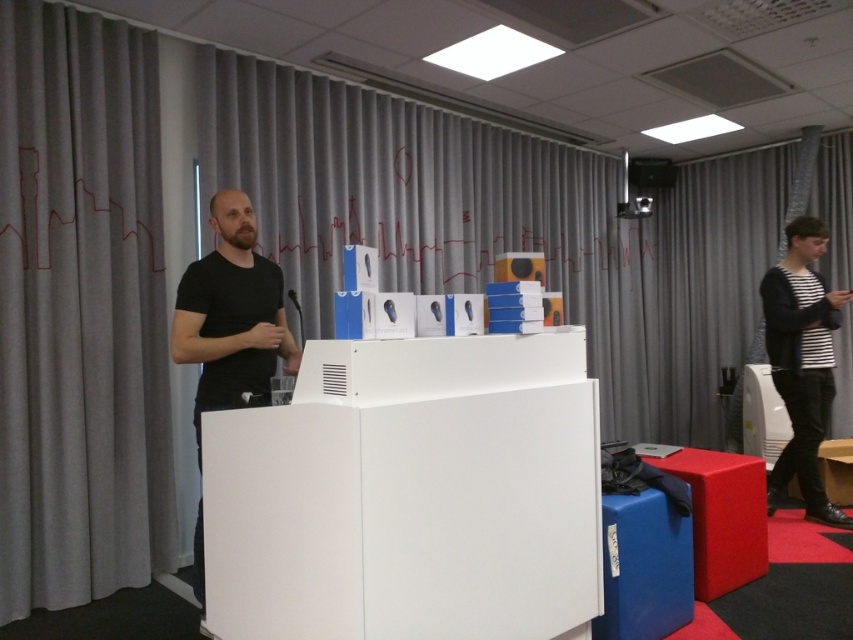
Is black matte shirt at center taller than rubberized red stool at lower right?

Yes, black matte shirt at center is taller than rubberized red stool at lower right.

Does black matte shirt at center appear on the right side of rubberized red stool at lower right?

No, black matte shirt at center is not to the right of rubberized red stool at lower right.

Where is `black matte shirt at center`? black matte shirt at center is located at coordinates (231, 316).

Between rubberized red stool at lower right and matte black projector at upper center, which one appears on the right side from the viewer's perspective?

matte black projector at upper center is more to the right.

Find the location of `rubberized red stool at lower right`. rubberized red stool at lower right is located at coordinates (723, 516).

In order to click on rubberized red stool at lower right in this screenshot , I will do `click(723, 516)`.

Can you confirm if black matte shirt at center is smaller than matte black projector at upper center?

Incorrect, black matte shirt at center is not smaller in size than matte black projector at upper center.

Is point (213, 308) more distant than point (635, 208)?

No, it is in front of (635, 208).

What do you see at coordinates (231, 316) in the screenshot? I see `black matte shirt at center` at bounding box center [231, 316].

You are a GUI agent. You are given a task and a screenshot of the screen. Output one action in this format:
    pyautogui.click(x=<x>, y=<y>)
    Task: Click on the black matte shirt at center
    The image size is (853, 640).
    Given the screenshot: What is the action you would take?
    pyautogui.click(x=231, y=316)